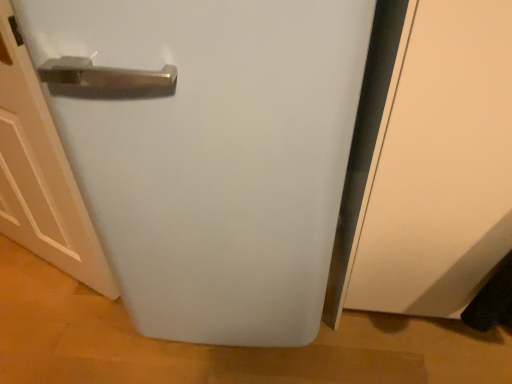
Where is `vacant area that lies in front of white matte door at left`? The image size is (512, 384). vacant area that lies in front of white matte door at left is located at coordinates (31, 345).